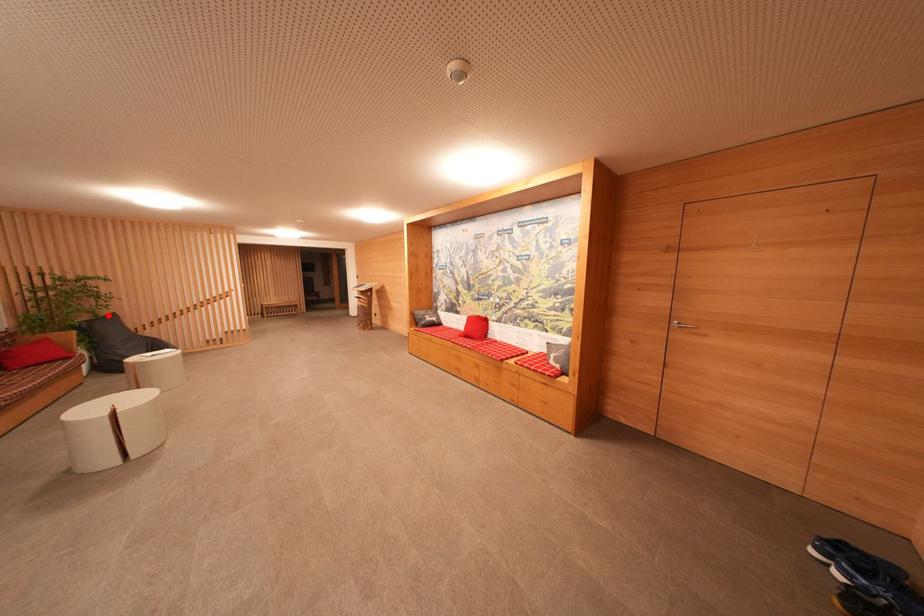
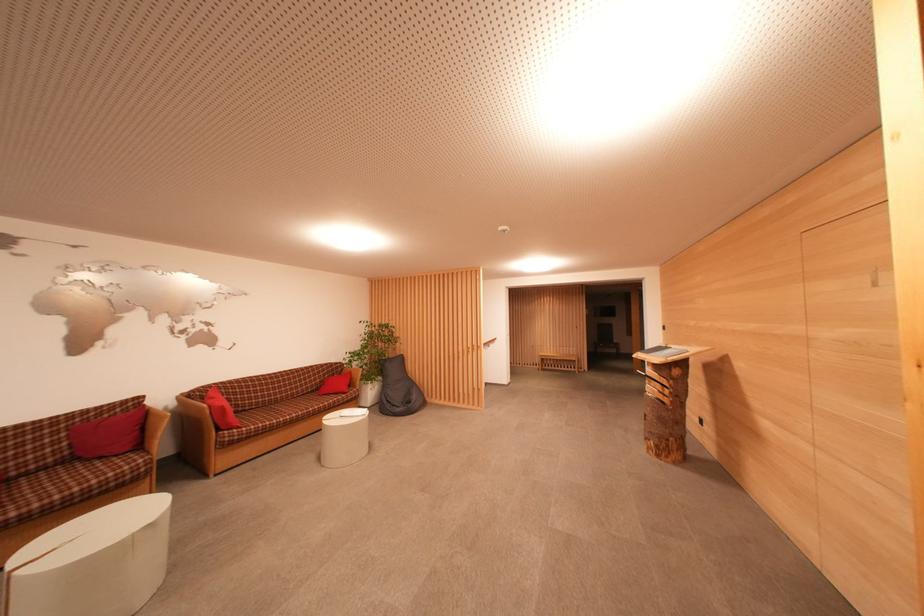
In the second image, find the point that corresponds to the highlighted location in the first image.

(402, 357)